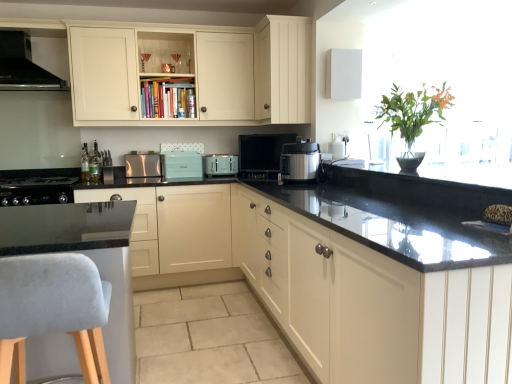
Question: From a real-world perspective, is teal matte toaster at center, which is counted as the 2th appliance, starting from the right, above or below cream matte cabinet at upper center, placed as the 1th cabinetry when sorted from top to bottom?

Choices:
 (A) below
 (B) above

Answer: (A)

Question: Considering the positions of point (176, 168) and point (211, 117), is point (176, 168) closer or farther from the camera than point (211, 117)?

Choices:
 (A) closer
 (B) farther

Answer: (B)

Question: Which object is positioned closest to the black matte range hood at upper left, placed as the 4th kitchen appliance when sorted from right to left?

Choices:
 (A) matte cream cabinets at center, which is the 3th cabinetry in top-to-bottom order
 (B) metallic silver toaster at center, acting as the third appliance starting from the left
 (C) smooth black countertop at lower left, positioned as the 1th countertop in back-to-front order
 (D) black granite countertop at lower left, marked as the second countertop in a back-to-front arrangement
 (E) teal matte toaster at center, marked as the 2th kitchen appliance in a bottom-to-top arrangement

Answer: (C)

Question: Estimate the real-world distances between objects in this image. Which object is farther from the black granite countertop at lower left, which is the first countertop from front to back?

Choices:
 (A) green glass bottle at left, which ranks as the second bottle in front-to-back order
 (B) clear glass bottle at left, acting as the first bottle starting from the front
 (C) metallic silver toaster at center, acting as the third appliance starting from the left
 (D) satin silver pressure cooker at center, which is counted as the 4th kitchen appliance, starting from the left
 (E) teal matte toaster at center, which is counted as the 2th appliance, starting from the right

Answer: (B)